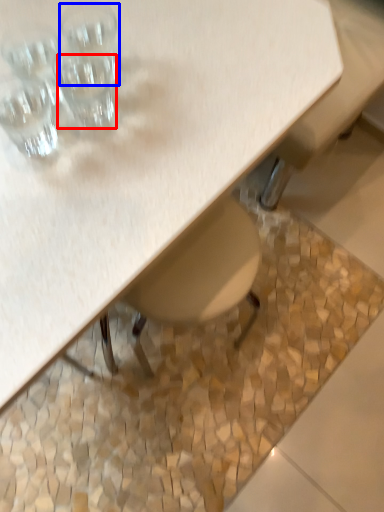
Question: Which of the following is the closest to the observer, shot glass (highlighted by a red box) or shot glass (highlighted by a blue box)?

Choices:
 (A) shot glass
 (B) shot glass

Answer: (A)